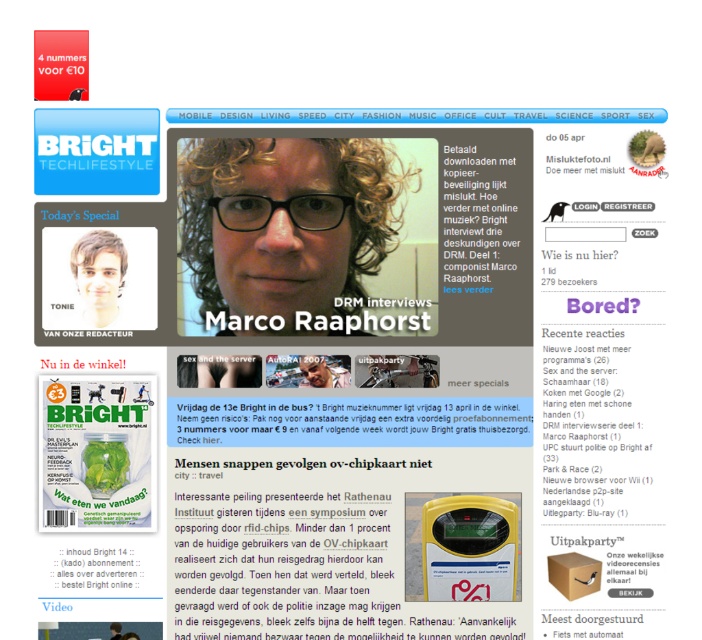
Question: From the image, what is the correct spatial relationship of matte black headshot at upper left in relation to black paper at lower left?

Choices:
 (A) below
 (B) above

Answer: (B)

Question: Among these objects, which one is farthest from the camera?

Choices:
 (A) green plastic bag at center
 (B) matte black glasses at center

Answer: (B)

Question: Can you confirm if black paper at lower left is smaller than matte black glasses at center?

Choices:
 (A) yes
 (B) no

Answer: (B)

Question: Can you confirm if green plastic bag at center is bigger than matte black glasses at center?

Choices:
 (A) no
 (B) yes

Answer: (B)

Question: Which of the following is the closest to the observer?

Choices:
 (A) (512, 168)
 (B) (100, 301)
 (C) (314, 368)

Answer: (B)

Question: Which point is farther to the camera?

Choices:
 (A) (526, 220)
 (B) (476, 433)
 (C) (264, 328)

Answer: (C)